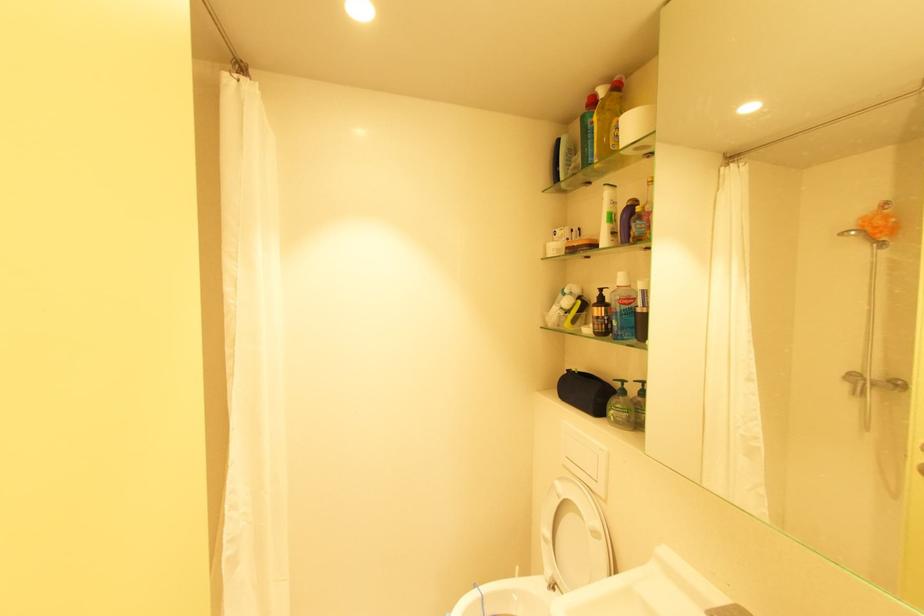
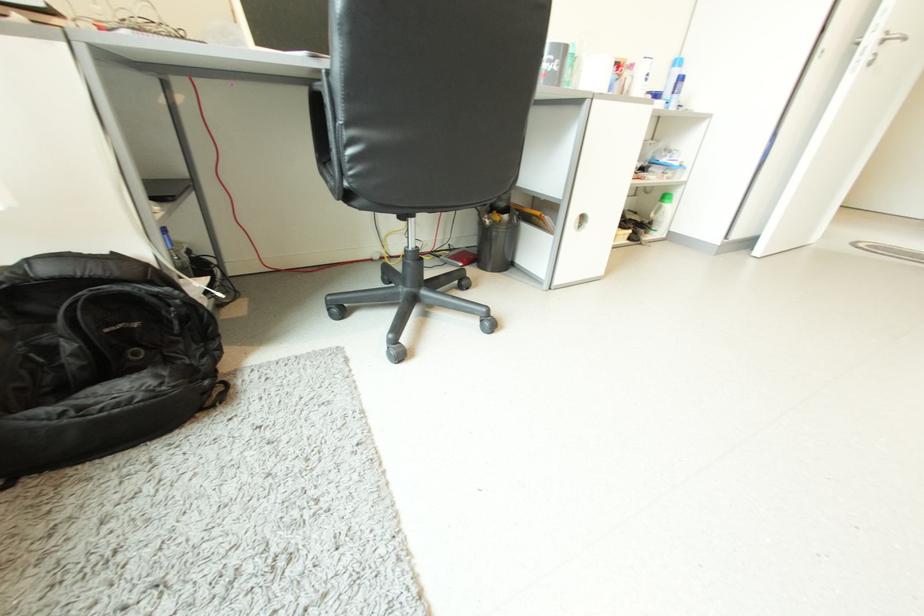
Question: I am providing you with two images of the same scene from different viewpoints. Which of the following objects are not visible in image2?

Choices:
 (A) red smartphone
 (B) brown pump dispenser head
 (C) purple fluffy pillow
 (D) blue aerosol can

Answer: (B)